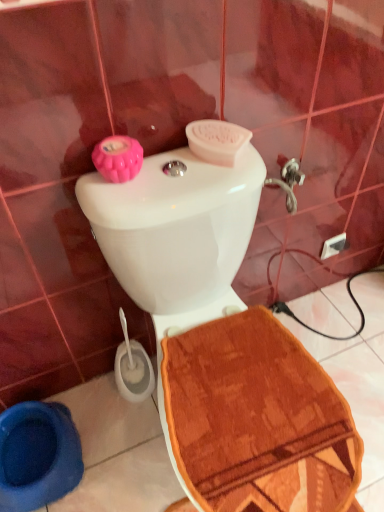
Question: Is blue rubber toilet bowl at lower left further to the viewer compared to white glossy toilet at center?

Choices:
 (A) yes
 (B) no

Answer: (A)

Question: From a real-world perspective, is blue rubber toilet bowl at lower left positioned over white glossy toilet at center based on gravity?

Choices:
 (A) no
 (B) yes

Answer: (A)

Question: Does blue rubber toilet bowl at lower left touch white glossy toilet at center?

Choices:
 (A) no
 (B) yes

Answer: (A)

Question: From a real-world perspective, does blue rubber toilet bowl at lower left sit lower than white glossy toilet at center?

Choices:
 (A) no
 (B) yes

Answer: (B)

Question: Could white glossy toilet at center be considered to be inside blue rubber toilet bowl at lower left?

Choices:
 (A) yes
 (B) no

Answer: (B)

Question: Is blue rubber toilet bowl at lower left outside white glossy toilet at center?

Choices:
 (A) no
 (B) yes

Answer: (B)

Question: Considering the relative sizes of white glossy toilet at center and blue rubber toilet bowl at lower left in the image provided, is white glossy toilet at center smaller than blue rubber toilet bowl at lower left?

Choices:
 (A) no
 (B) yes

Answer: (A)

Question: Is the depth of white glossy toilet at center less than that of blue rubber toilet bowl at lower left?

Choices:
 (A) no
 (B) yes

Answer: (B)

Question: Considering the relative positions of white glossy toilet at center and blue rubber toilet bowl at lower left in the image provided, is white glossy toilet at center to the left of blue rubber toilet bowl at lower left from the viewer's perspective?

Choices:
 (A) yes
 (B) no

Answer: (B)

Question: From a real-world perspective, is white glossy toilet at center over blue rubber toilet bowl at lower left?

Choices:
 (A) yes
 (B) no

Answer: (A)

Question: Are white glossy toilet at center and blue rubber toilet bowl at lower left beside each other?

Choices:
 (A) no
 (B) yes

Answer: (A)

Question: Is white glossy toilet at center positioned far away from blue rubber toilet bowl at lower left?

Choices:
 (A) no
 (B) yes

Answer: (A)

Question: From the image's perspective, relative to white glossy toilet at center, is blue rubber toilet bowl at lower left above or below?

Choices:
 (A) below
 (B) above

Answer: (A)